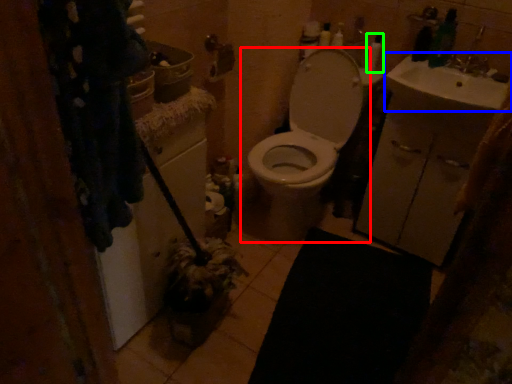
Question: Considering the real-world distances, which object is farthest from toilet (highlighted by a red box)? sink (highlighted by a blue box) or toiletry (highlighted by a green box)?

Choices:
 (A) sink
 (B) toiletry

Answer: (B)